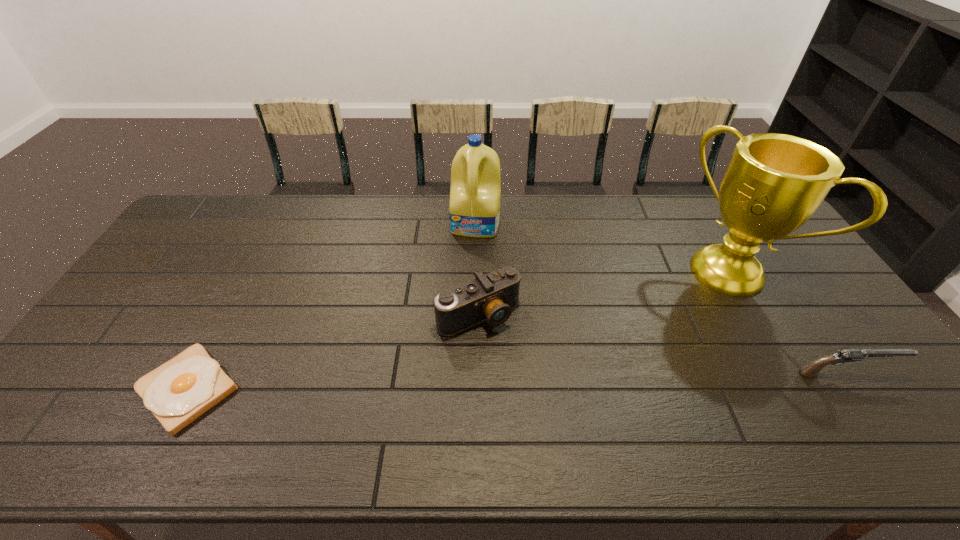
In order to click on the leftmost object in this screenshot , I will do `click(178, 392)`.

You are a GUI agent. You are given a task and a screenshot of the screen. Output one action in this format:
    pyautogui.click(x=<x>, y=<y>)
    Task: Click on the toast
    
    Given the screenshot: What is the action you would take?
    pyautogui.click(x=178, y=392)

I want to click on the fourth tallest object, so click(812, 369).

At what (x,y) coordinates should I click in order to perform the action: click on the third tallest object. Please return your answer as a coordinate pair (x, y). The height and width of the screenshot is (540, 960). Looking at the image, I should click on (491, 297).

Image resolution: width=960 pixels, height=540 pixels. I want to click on the fourth shortest object, so click(x=475, y=190).

Identify the location of award. (774, 183).

What are the coordinates of `vacant area situated 0.280m on the back of the shortest object` in the screenshot? It's located at (249, 275).

I want to click on vacant area situated on the lens of the third tallest object, so click(517, 358).

Locate an element on the screen. free location located on the lens of the third tallest object is located at coordinates (536, 381).

I want to click on free location located 0.200m on the lens of the third tallest object, so click(x=542, y=390).